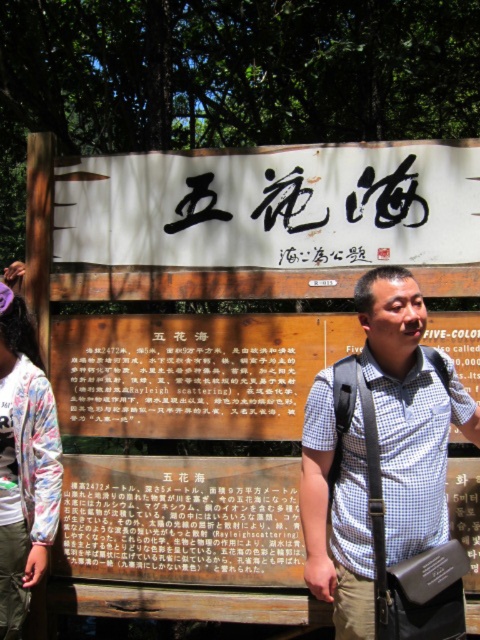
You are a tourist standing in front of the signboard in the image. You want to read the text on the wooden signboard at center and the matte brown signboard at center. Which one can you read more clearly?

The wooden signboard at center is closer to the viewer than the matte brown signboard at center, so you can read the wooden signboard at center more clearly.

You are a hiker who wants to read the information on the wooden signboard at center and the matte brown signboard at center. Which signboard should you look up towards first?

The wooden signboard at center is positioned under the matte brown signboard at center, so you should look up towards the matte brown signboard at center first.

You are a photographer trying to capture a clear shot of the black paper at center while also including the white checkered shirt at center in the frame. Based on their sizes, which object should you focus on first to ensure both are in focus?

Since the white checkered shirt at center is narrower than the black paper at center, you should focus on the black paper at center first as it is wider and will require more attention to capture details clearly.